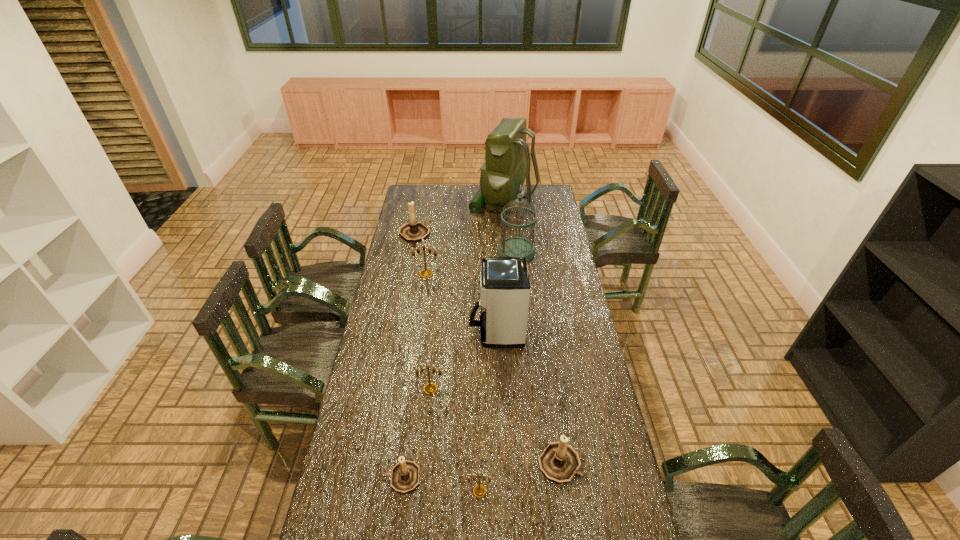
Find the location of `object located at the far edge`. object located at the far edge is located at coordinates (507, 163).

Where is `backpack situated at the right edge`? The image size is (960, 540). backpack situated at the right edge is located at coordinates (507, 163).

I want to click on candle holder that is positioned at the right edge, so click(x=559, y=462).

In order to click on object that is at the far right corner in this screenshot , I will do click(507, 163).

This screenshot has height=540, width=960. Identify the location of blank space at the far edge. (433, 200).

What are the coordinates of `free space at the left edge of the desktop` in the screenshot? It's located at (407, 264).

This screenshot has width=960, height=540. In the image, there is a desktop. Find the location of `blank space at the right edge`. blank space at the right edge is located at coordinates (561, 219).

At what (x,y) coordinates should I click in order to perform the action: click on vacant area at the far left corner. Please return your answer as a coordinate pair (x, y). Looking at the image, I should click on (429, 194).

You are a GUI agent. You are given a task and a screenshot of the screen. Output one action in this format:
    pyautogui.click(x=<x>, y=<y>)
    Task: Click on the vacant space at the far right corner of the desktop
    Image resolution: width=960 pixels, height=540 pixels.
    Given the screenshot: What is the action you would take?
    pyautogui.click(x=542, y=186)

Find the location of `vacant space in between the coffee maker and the farthest candelabrum`. vacant space in between the coffee maker and the farthest candelabrum is located at coordinates (455, 282).